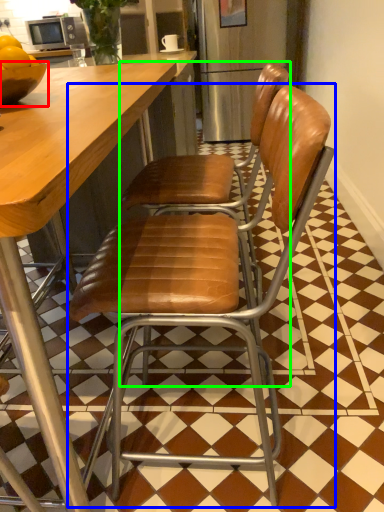
Question: Which object is positioned farthest from bowl (highlighted by a red box)? Select from chair (highlighted by a blue box) and chair (highlighted by a green box).

Choices:
 (A) chair
 (B) chair

Answer: (A)